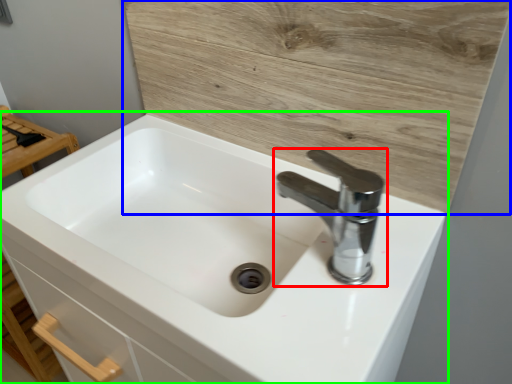
Question: Considering the real-world distances, which object is closest to tap (highlighted by a red box)? plywood (highlighted by a blue box) or sink (highlighted by a green box).

Choices:
 (A) plywood
 (B) sink

Answer: (A)